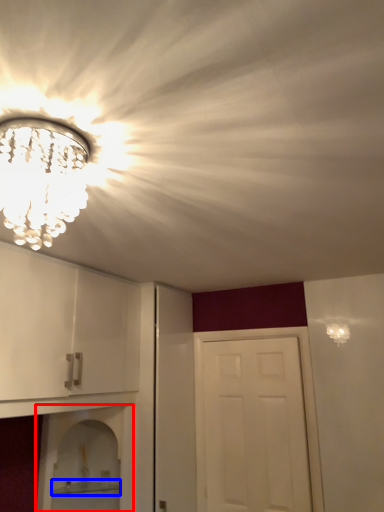
Question: Among these objects, which one is farthest to the camera, shelf (highlighted by a red box) or shelf (highlighted by a blue box)?

Choices:
 (A) shelf
 (B) shelf

Answer: (B)